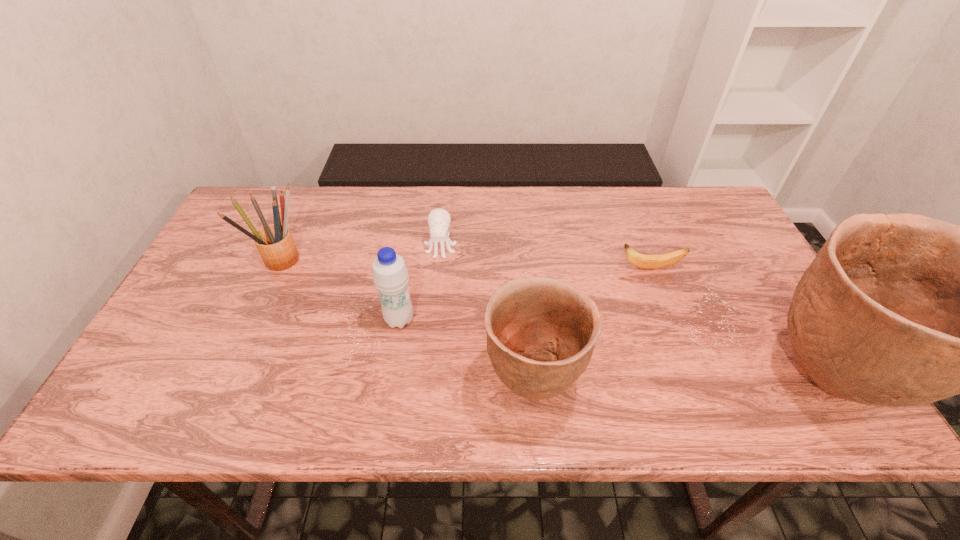
Locate which object ranks third in proximity to the water bottle. Please provide its 2D coordinates. Your answer should be formatted as a tuple, i.e. [(x, y)], where the tuple contains the x and y coordinates of a point satisfying the conditions above.

[(274, 242)]

Point out which object is positioned as the second nearest to the shortest object. Please provide its 2D coordinates. Your answer should be formatted as a tuple, i.e. [(x, y)], where the tuple contains the x and y coordinates of a point satisfying the conditions above.

[(541, 332)]

At what (x,y) coordinates should I click in order to perform the action: click on vacant space that satisfies the following two spatial constraints: 1. at the stem of the tallest object; 2. on the left side of the fifth object from left to right. Please return your answer as a coordinate pair (x, y). Looking at the image, I should click on (691, 379).

The height and width of the screenshot is (540, 960). What are the coordinates of `free region that satisfies the following two spatial constraints: 1. on the back side of the tallest object; 2. at the stem of the shortest object` in the screenshot? It's located at (759, 268).

Find the location of a particular element. free space that satisfies the following two spatial constraints: 1. at the stem of the shortest object; 2. on the right side of the tallest object is located at coordinates (691, 379).

Locate an element on the screen. The height and width of the screenshot is (540, 960). free space that satisfies the following two spatial constraints: 1. at the stem of the shortest object; 2. on the front side of the water bottle is located at coordinates (669, 320).

Where is `vacant space that satisfies the following two spatial constraints: 1. on the back side of the tallest object; 2. at the stem of the shortest object`? This screenshot has width=960, height=540. vacant space that satisfies the following two spatial constraints: 1. on the back side of the tallest object; 2. at the stem of the shortest object is located at coordinates (759, 268).

Identify the location of vacant space that satisfies the following two spatial constraints: 1. at the stem of the right pottery; 2. on the left side of the banana. (691, 379).